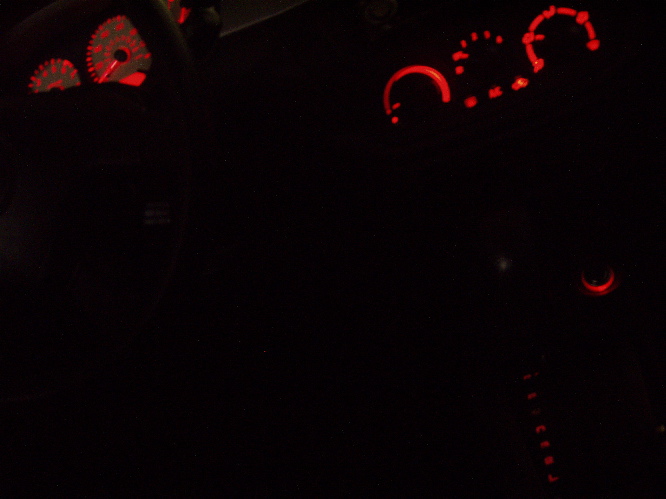
Where is `wall`? Image resolution: width=666 pixels, height=499 pixels. wall is located at coordinates (360, 262).